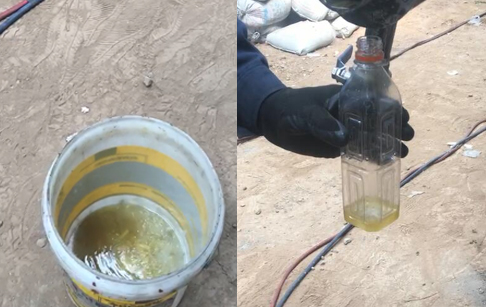
Where is `electric cords`? This screenshot has height=307, width=486. electric cords is located at coordinates (439, 37), (429, 161).